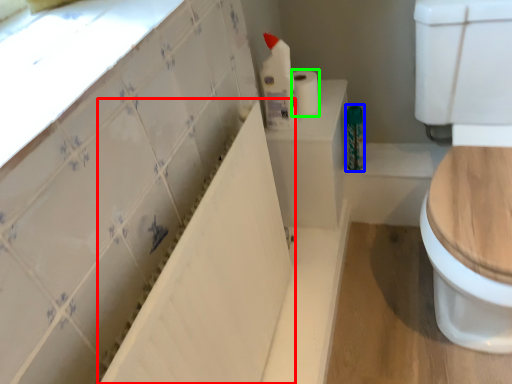
Question: Based on their relative distances, which object is farther from bath (highlighted by a red box)? Choose from toiletry (highlighted by a blue box) and toilet paper (highlighted by a green box).

Choices:
 (A) toiletry
 (B) toilet paper

Answer: (A)